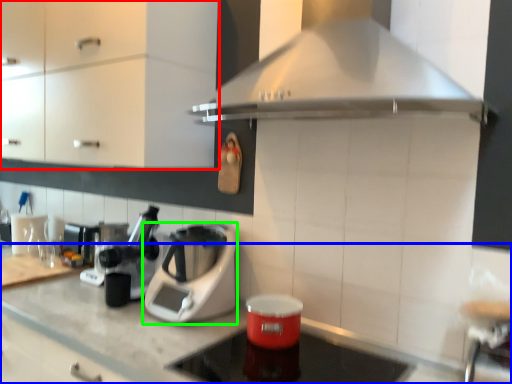
Question: Which object is positioned farthest from cabinetry (highlighted by a red box)? Select from countertop (highlighted by a blue box) and kitchen appliance (highlighted by a green box).

Choices:
 (A) countertop
 (B) kitchen appliance

Answer: (A)